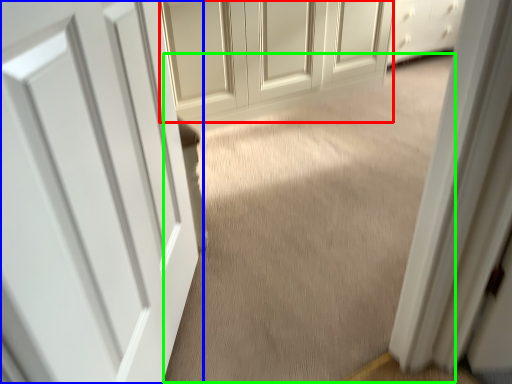
Question: Considering the real-world distances, which object is closest to door (highlighted by a red box)? door (highlighted by a blue box) or plain (highlighted by a green box).

Choices:
 (A) door
 (B) plain

Answer: (B)